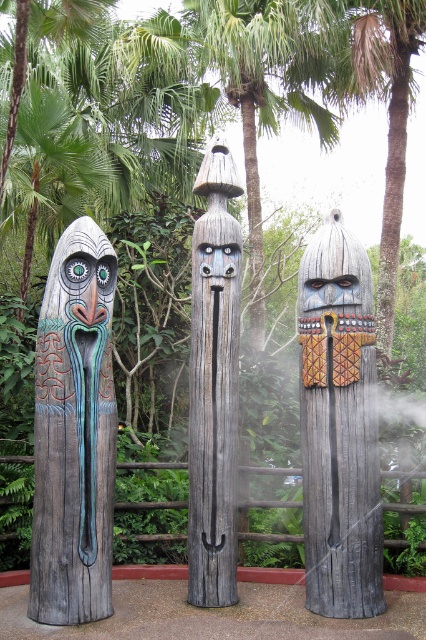
Is carved wood totem at left to the left of matte wood mask at left from the viewer's perspective?

Correct, you'll find carved wood totem at left to the left of matte wood mask at left.

Is carved wood totem at left positioned in front of matte wood mask at left?

That is True.

Between point (48, 324) and point (62, 272), which one is positioned behind?

Point (62, 272)

Identify the location of carved wood totem at left. The height and width of the screenshot is (640, 426). (74, 433).

Is point (311, 346) positioned before point (227, 474)?

Yes, it is.

Locate an element on the screen. wooden totem at center is located at coordinates (339, 428).

Can you confirm if wooden totem at center is smaller than matte wood mask at left?

No.

From the picture: Is wooden totem at center further to camera compared to matte wood mask at left?

That is True.

Does point (373, 449) lie behind point (97, 280)?

Yes, it is.

Identify the location of wooden totem at center. Image resolution: width=426 pixels, height=640 pixels. (339, 428).